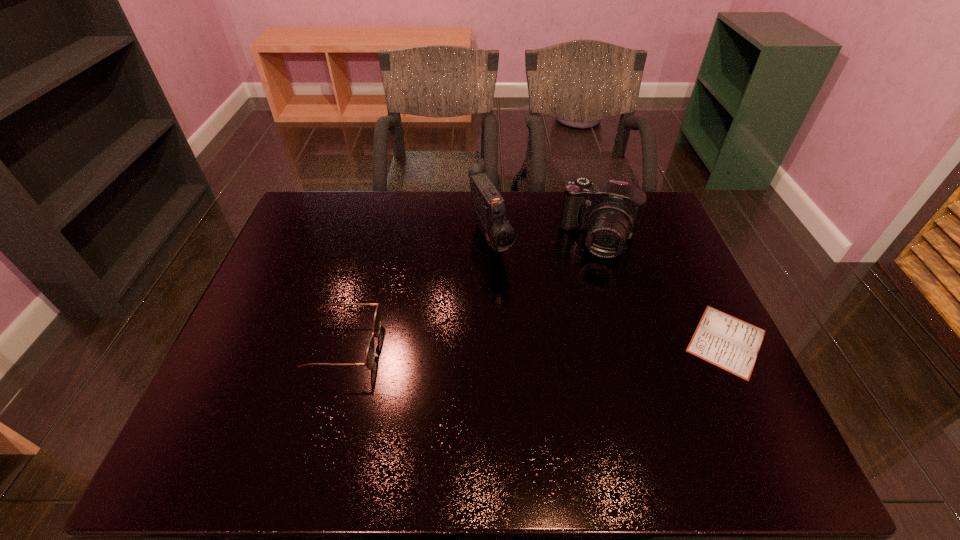
Image resolution: width=960 pixels, height=540 pixels. I want to click on free spot that satisfies the following two spatial constraints: 1. on the front side of the third shortest object; 2. on the left side of the rightmost object, so click(630, 341).